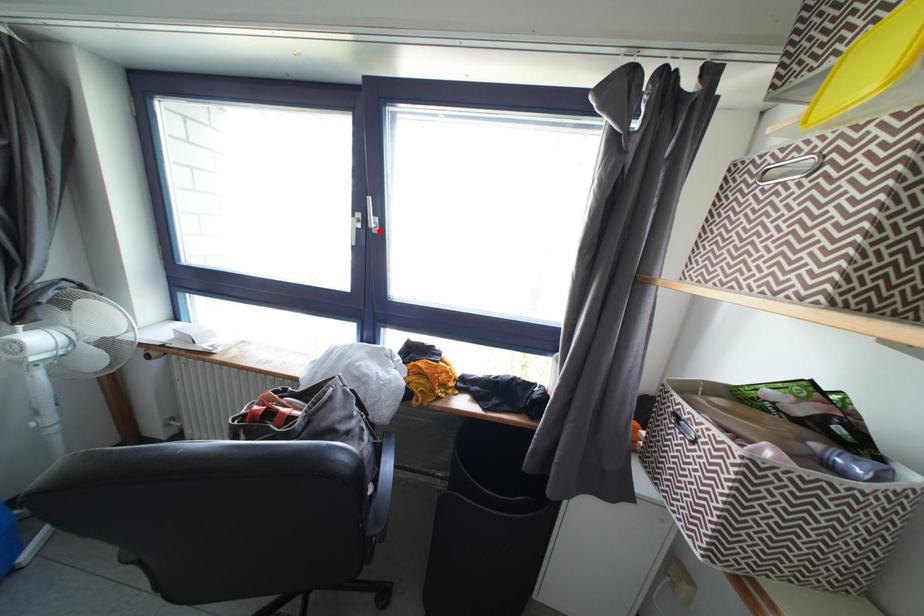
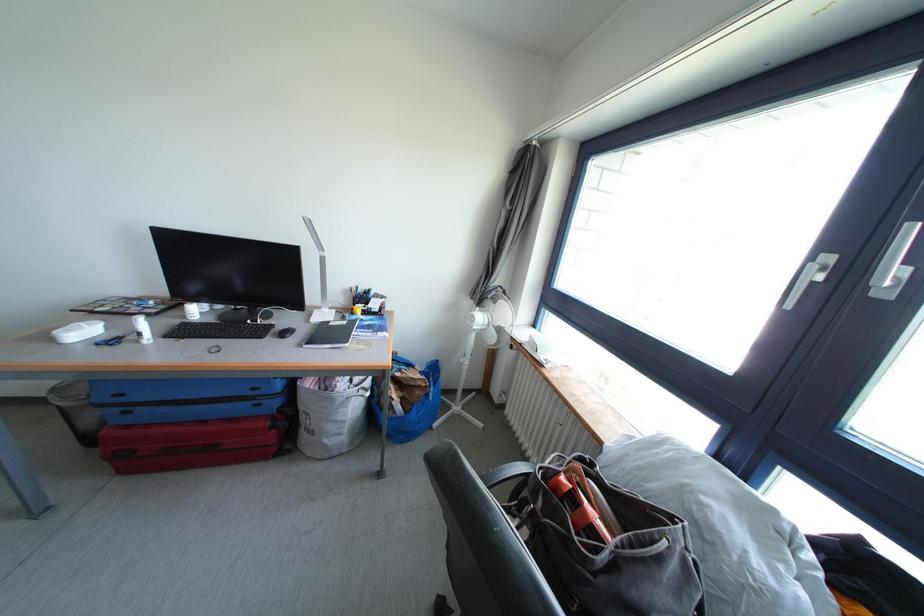
Find the pixel in the second image that matches the highlighted location in the first image.

(894, 288)